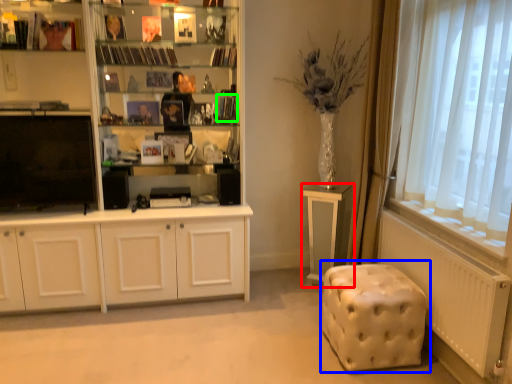
Question: Considering the real-world distances, which object is farthest from table (highlighted by a red box)? music stool (highlighted by a blue box) or book (highlighted by a green box)?

Choices:
 (A) music stool
 (B) book

Answer: (B)